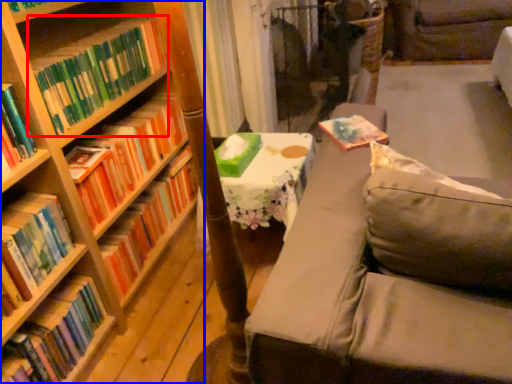
Question: Which object appears closest to the camera in this image, book (highlighted by a red box) or bookcase (highlighted by a blue box)?

Choices:
 (A) book
 (B) bookcase

Answer: (B)